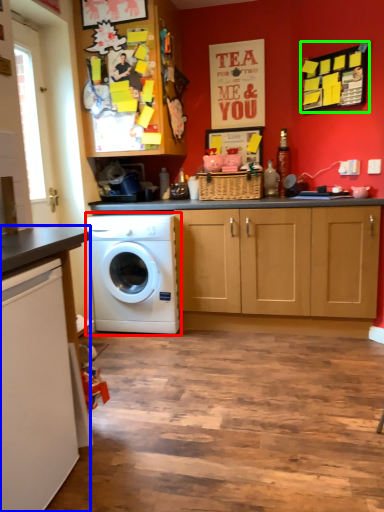
Question: Estimate the real-world distances between objects in this image. Which object is farther from washing machine (highlighted by a red box), countertop (highlighted by a blue box) or bulletin board (highlighted by a green box)?

Choices:
 (A) countertop
 (B) bulletin board

Answer: (B)